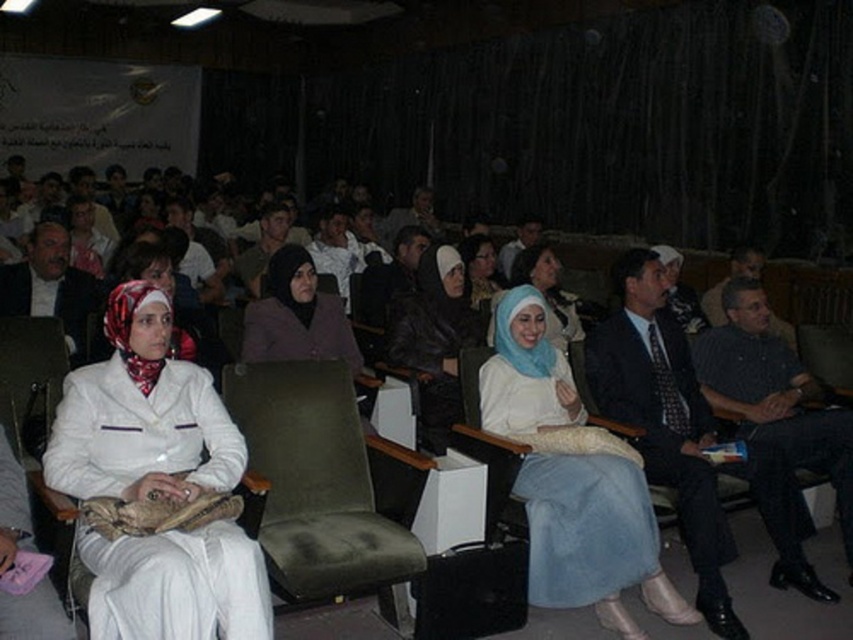
In the scene shown: You are sitting in the auditorium and want to determine which of the two points, point (x=48, y=236) or point (x=270, y=237), is closer to you. Based on the scene description, which point is nearer?

Point (x=48, y=236) is closer to the viewer than point (x=270, y=237).

You are sitting in the front row of the auditorium and want to hand a note to the person wearing the dark gray shirt at center and the matte black jacket at center. Which one is closer to you?

The dark gray shirt at center is closer to the viewer than the matte black jacket at center, so you should approach the person wearing the dark gray shirt at center first as they are nearer to you.